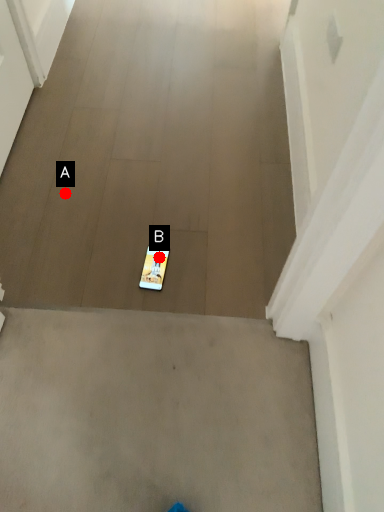
Question: Two points are circled on the image, labeled by A and B beside each circle. Which point appears farthest from the camera in this image?

Choices:
 (A) A is further
 (B) B is further

Answer: (A)